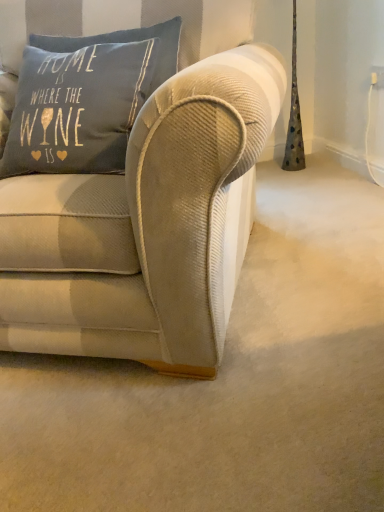
Question: Should I look upward or downward to see blue cotton pillow at upper left, the 1th pillow from the bottom?

Choices:
 (A) up
 (B) down

Answer: (A)

Question: Considering the relative sizes of blue cotton pillow at upper left, which is the 2th pillow in top-to-bottom order, and textured gray pillow at upper left, which is the first pillow from top to bottom, in the image provided, is blue cotton pillow at upper left, which is the 2th pillow in top-to-bottom order, thinner than textured gray pillow at upper left, which is the first pillow from top to bottom,?

Choices:
 (A) no
 (B) yes

Answer: (A)

Question: Is blue cotton pillow at upper left, the 1th pillow from the bottom, placed right next to textured gray pillow at upper left, which ranks as the second pillow in bottom-to-top order?

Choices:
 (A) no
 (B) yes

Answer: (A)

Question: Is the position of blue cotton pillow at upper left, which is the 2th pillow in top-to-bottom order, more distant than that of textured gray pillow at upper left, which ranks as the second pillow in bottom-to-top order?

Choices:
 (A) no
 (B) yes

Answer: (A)

Question: From the image's perspective, is blue cotton pillow at upper left, the 1th pillow from the bottom, located beneath textured gray pillow at upper left, which is the first pillow from top to bottom?

Choices:
 (A) yes
 (B) no

Answer: (A)

Question: Can you confirm if blue cotton pillow at upper left, the 1th pillow from the bottom, is wider than textured gray pillow at upper left, which is the first pillow from top to bottom?

Choices:
 (A) no
 (B) yes

Answer: (B)

Question: From a real-world perspective, is blue cotton pillow at upper left, the 1th pillow from the bottom, below textured gray pillow at upper left, which is the first pillow from top to bottom?

Choices:
 (A) yes
 (B) no

Answer: (A)

Question: From the image's perspective, would you say blue cotton pillow at upper left, which is the 2th pillow in top-to-bottom order, is shown under beige corduroy couch at center?

Choices:
 (A) yes
 (B) no

Answer: (B)

Question: Are blue cotton pillow at upper left, which is the 2th pillow in top-to-bottom order, and beige corduroy couch at center beside each other?

Choices:
 (A) yes
 (B) no

Answer: (B)

Question: Is blue cotton pillow at upper left, which is the 2th pillow in top-to-bottom order, not near beige corduroy couch at center?

Choices:
 (A) yes
 (B) no

Answer: (B)

Question: Is blue cotton pillow at upper left, the 1th pillow from the bottom, looking in the opposite direction of beige corduroy couch at center?

Choices:
 (A) no
 (B) yes

Answer: (B)

Question: From the image's perspective, is blue cotton pillow at upper left, which is the 2th pillow in top-to-bottom order, on beige corduroy couch at center?

Choices:
 (A) yes
 (B) no

Answer: (A)

Question: Does blue cotton pillow at upper left, which is the 2th pillow in top-to-bottom order, turn towards beige corduroy couch at center?

Choices:
 (A) no
 (B) yes

Answer: (B)

Question: Does textured gray pillow at upper left, which is the first pillow from top to bottom, appear on the left side of blue cotton pillow at upper left, which is the 2th pillow in top-to-bottom order?

Choices:
 (A) no
 (B) yes

Answer: (A)